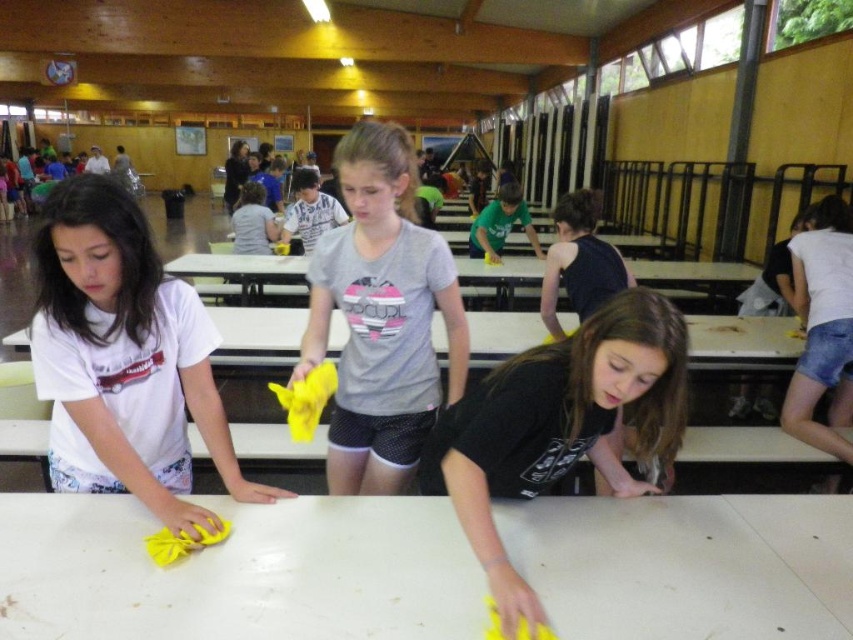
Question: Which of the following is the farthest from the observer?

Choices:
 (A) (335, 292)
 (B) (84, 472)

Answer: (A)

Question: Does white printed t-shirt at left appear on the right side of black matte shirt at lower center?

Choices:
 (A) no
 (B) yes

Answer: (A)

Question: Which is farther from the white printed t-shirt at left?

Choices:
 (A) gray matte t-shirt at center
 (B) dark blue jersey at center
 (C) black matte shirt at lower center
 (D) white glossy table at center

Answer: (B)

Question: Is white printed t-shirt at left positioned in front of dark blue jersey at center?

Choices:
 (A) yes
 (B) no

Answer: (A)

Question: Which point is farther from the camera taking this photo?

Choices:
 (A) (596, 275)
 (B) (155, 362)
 (C) (344, 196)
 (D) (314, 547)

Answer: (A)

Question: Is the position of white glossy table at center more distant than that of dark blue jersey at center?

Choices:
 (A) no
 (B) yes

Answer: (A)